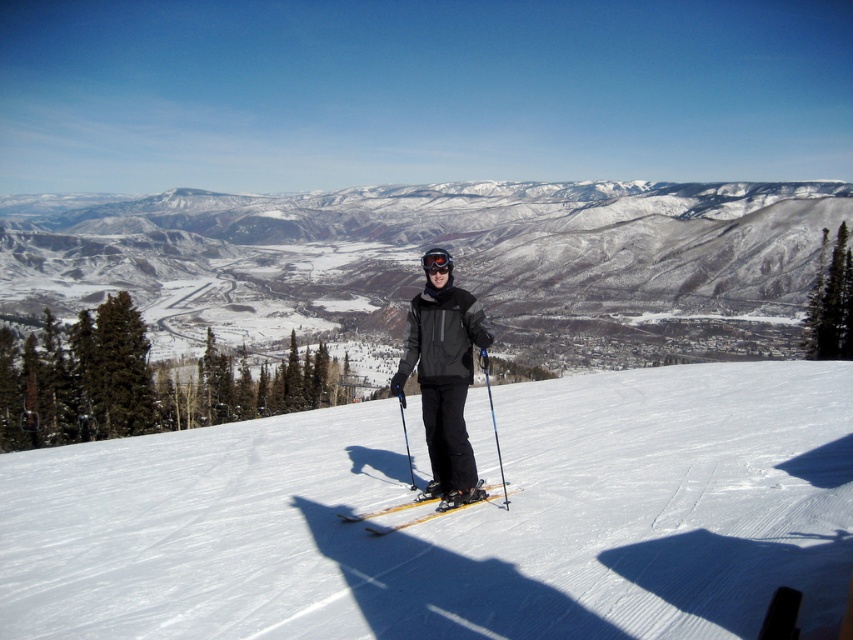
Question: Which of the following is the farthest from the observer?

Choices:
 (A) black matte ski suit at center
 (B) blue plastic ski pole at center
 (C) black matte goggles at center
 (D) white snow at center

Answer: (C)

Question: Is black matte ski suit at center to the right of yellow matte skis at center from the viewer's perspective?

Choices:
 (A) yes
 (B) no

Answer: (B)

Question: Which point appears closest to the camera in this image?

Choices:
 (A) [503, 493]
 (B) [445, 266]
 (C) [90, 253]

Answer: (A)

Question: Which of these objects is positioned closest to the black matte goggles at center?

Choices:
 (A) white snow at center
 (B) blue plastic ski pole at center
 (C) black matte ski suit at center

Answer: (A)

Question: Is white snow at center above snowy mountain at center?

Choices:
 (A) no
 (B) yes

Answer: (A)

Question: Can you confirm if black matte ski suit at center is positioned below blue plastic ski pole at center?

Choices:
 (A) yes
 (B) no

Answer: (A)